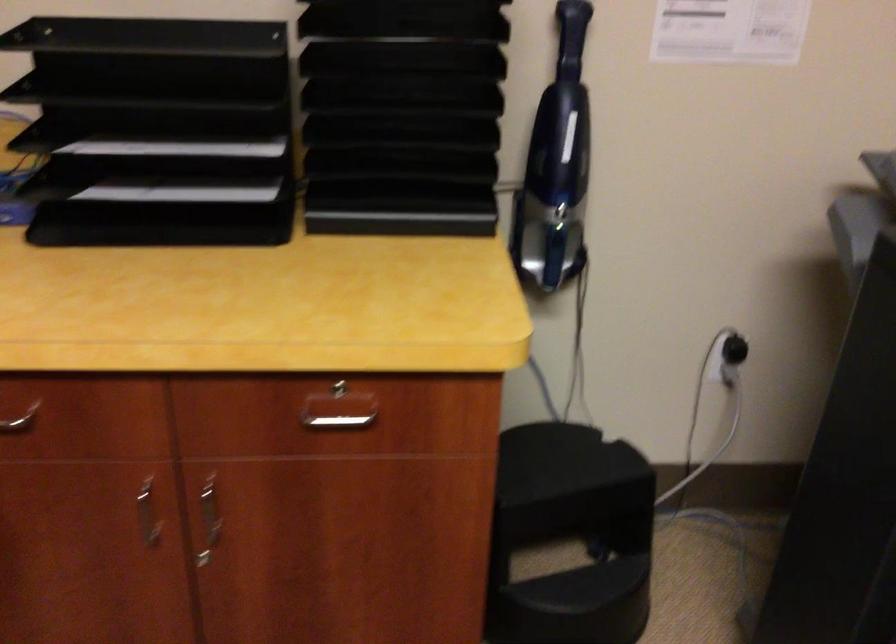
Locate an element on the screen. black step stool is located at coordinates (571, 536).